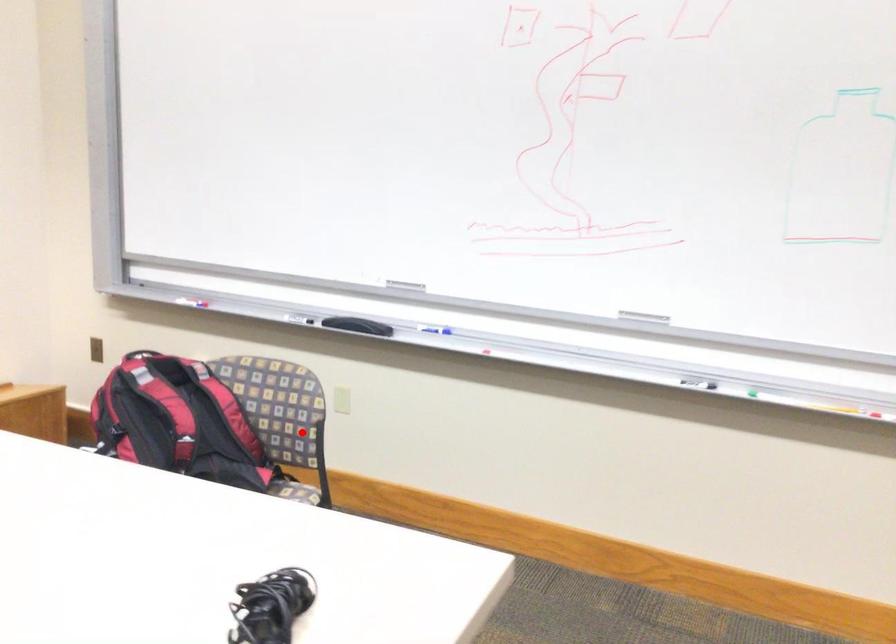
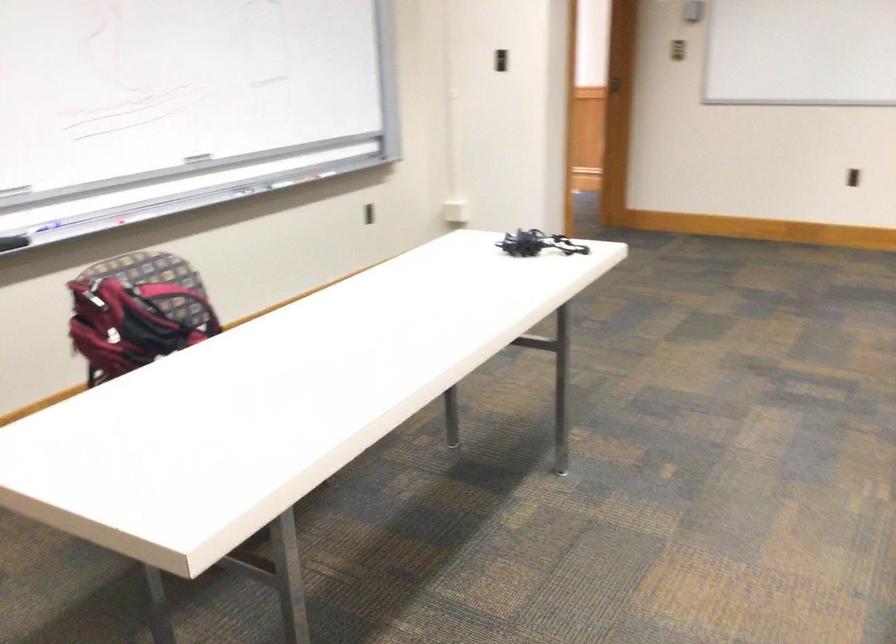
Locate, in the second image, the point that corresponds to the highlighted location in the first image.

(177, 301)